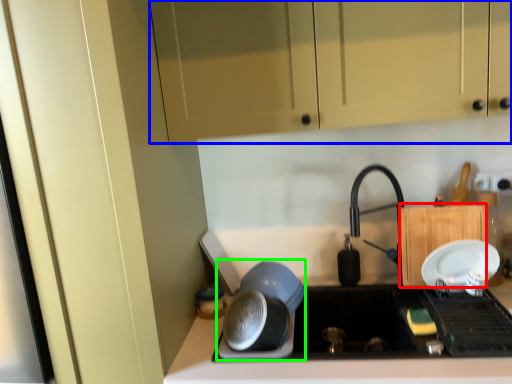
Question: Considering the real-world distances, which object is closest to cabinetry (highlighted by a red box)? cabinetry (highlighted by a blue box) or appliance (highlighted by a green box).

Choices:
 (A) cabinetry
 (B) appliance

Answer: (B)